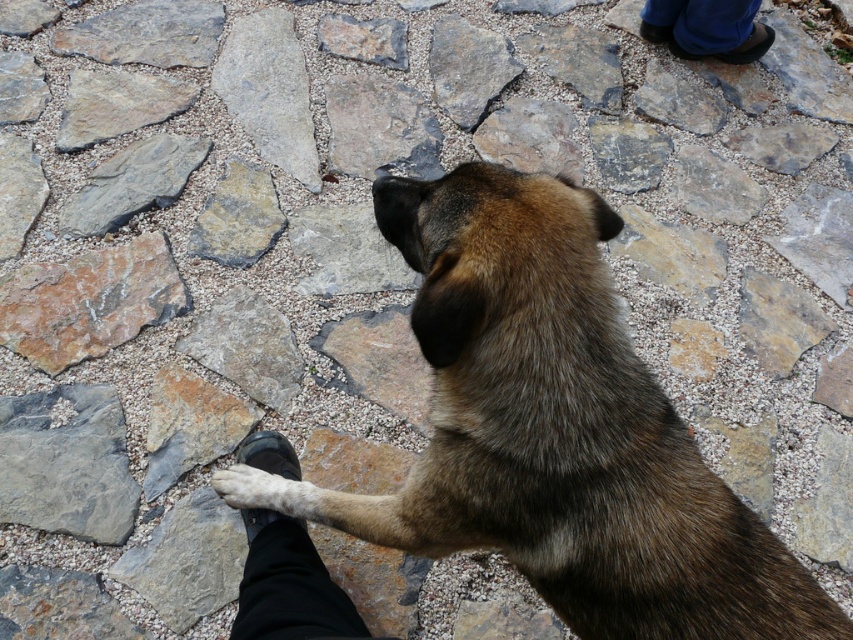
Question: Where is rusty stone at upper left located in relation to rusty metal stone at upper center in the image?

Choices:
 (A) above
 (B) below

Answer: (B)

Question: Which of the following is the closest to the observer?

Choices:
 (A) (267, 244)
 (B) (512, 522)
 (C) (9, 426)

Answer: (B)

Question: Which of the following is the farthest from the observer?

Choices:
 (A) gray/textured rock at lower left
 (B) gray/weathered rock at center
 (C) black leather shoe at lower center

Answer: (B)

Question: Does brown furry dog at center have a larger size compared to rusty metal stone at upper center?

Choices:
 (A) yes
 (B) no

Answer: (A)

Question: Can you confirm if brown furry dog at center is bigger than blue denim pants at upper right?

Choices:
 (A) no
 (B) yes

Answer: (B)

Question: Estimate the real-world distances between objects in this image. Which object is farther from the rusty stone at upper left?

Choices:
 (A) rusty metal stone at upper center
 (B) brown furry dog at center
 (C) gray rough stone at upper left

Answer: (A)